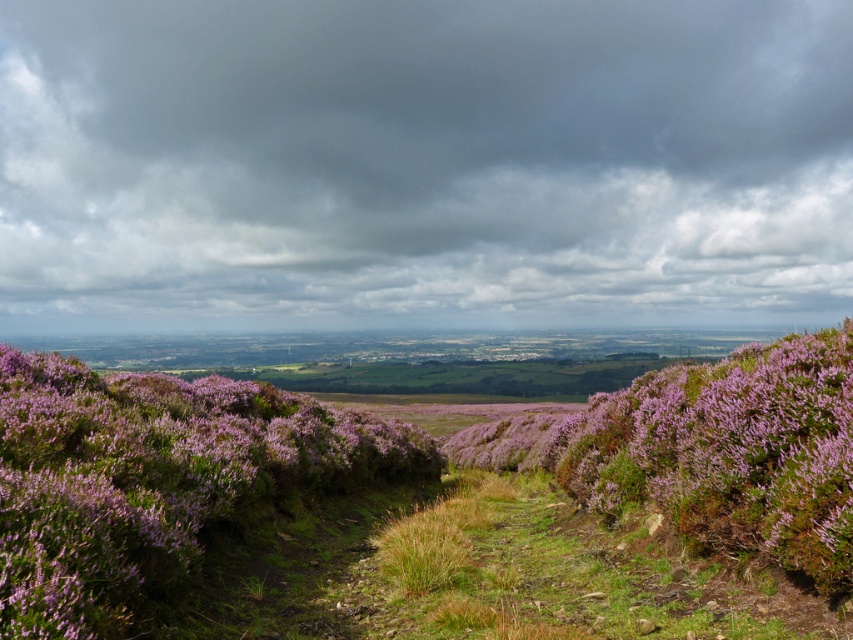
You are standing on the narrow winding path in the center of the image and want to pick a flower from the purple matte heather at center and the purple leafy bush at center. Which one can you reach without moving from your current position?

The purple matte heather at center is closer to the viewer than the purple leafy bush at center, so you can reach the purple matte heather at center without moving.